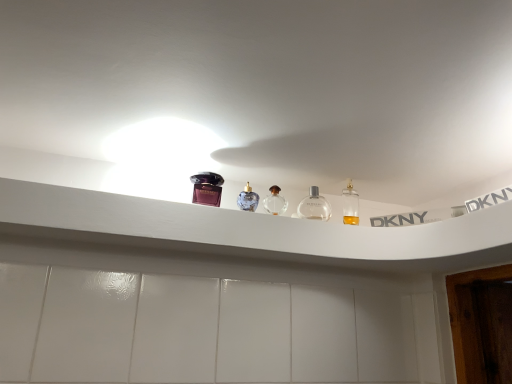
Question: In terms of width, does white plastic shelf at upper center look wider or thinner when compared to clear glass perfume at center, which is counted as the second bottle, starting from the right?

Choices:
 (A) thin
 (B) wide

Answer: (B)

Question: Based on their positions, is white plastic shelf at upper center located to the left or right of clear glass perfume at center, which is counted as the second bottle, starting from the right?

Choices:
 (A) left
 (B) right

Answer: (A)

Question: Estimate the real-world distances between objects in this image. Which object is closer to the white plastic shelf at upper center?

Choices:
 (A) clear glass bottle at center, which is the 1th bottle from right to left
 (B) clear glass perfume at center, the 1th bottle from the left
 (C) matte purple perfume at upper center

Answer: (C)

Question: Which object is the closest to the clear glass perfume at center, which is counted as the second bottle, starting from the right?

Choices:
 (A) clear glass bottle at center, which is the 1th bottle from right to left
 (B) matte purple perfume at upper center
 (C) white plastic shelf at upper center

Answer: (A)